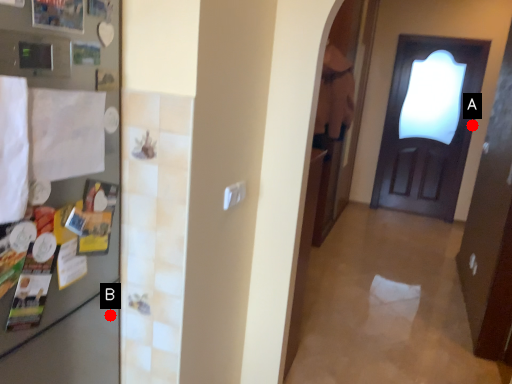
Question: Two points are circled on the image, labeled by A and B beside each circle. Which point is farther to the camera?

Choices:
 (A) A is further
 (B) B is further

Answer: (A)